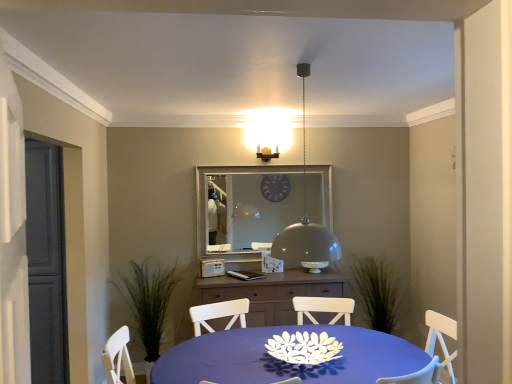
Question: Is white paper flower at center facing away from matte brown cabinet at center?

Choices:
 (A) yes
 (B) no

Answer: (B)

Question: Is white paper flower at center closer to camera compared to matte brown cabinet at center?

Choices:
 (A) no
 (B) yes

Answer: (B)

Question: Is white paper flower at center at the left side of matte brown cabinet at center?

Choices:
 (A) yes
 (B) no

Answer: (B)

Question: Are white paper flower at center and matte brown cabinet at center far apart?

Choices:
 (A) no
 (B) yes

Answer: (B)

Question: Is white paper flower at center directly adjacent to matte brown cabinet at center?

Choices:
 (A) no
 (B) yes

Answer: (A)

Question: From the image's perspective, is matte gray dome at center above or below matte brown cabinet at center?

Choices:
 (A) above
 (B) below

Answer: (A)

Question: Considering the positions of point (292, 246) and point (333, 296), is point (292, 246) closer or farther from the camera than point (333, 296)?

Choices:
 (A) farther
 (B) closer

Answer: (B)

Question: Considering the positions of matte gray dome at center and matte brown cabinet at center in the image, is matte gray dome at center taller or shorter than matte brown cabinet at center?

Choices:
 (A) short
 (B) tall

Answer: (B)

Question: Considering the positions of matte gray dome at center and matte brown cabinet at center in the image, is matte gray dome at center bigger or smaller than matte brown cabinet at center?

Choices:
 (A) big
 (B) small

Answer: (B)

Question: In terms of width, does white paper flower at center look wider or thinner when compared to matte brown pendant light at upper center?

Choices:
 (A) thin
 (B) wide

Answer: (B)

Question: From their relative heights in the image, would you say white paper flower at center is taller or shorter than matte brown pendant light at upper center?

Choices:
 (A) short
 (B) tall

Answer: (A)

Question: From the image's perspective, relative to matte brown pendant light at upper center, is white paper flower at center above or below?

Choices:
 (A) below
 (B) above

Answer: (A)

Question: From a real-world perspective, relative to matte brown pendant light at upper center, is white paper flower at center vertically above or below?

Choices:
 (A) above
 (B) below

Answer: (B)

Question: From their relative heights in the image, would you say green leafy plant at left is taller or shorter than matte gray glass door at left?

Choices:
 (A) tall
 (B) short

Answer: (B)

Question: From a real-world perspective, is green leafy plant at left above or below matte gray glass door at left?

Choices:
 (A) below
 (B) above

Answer: (A)